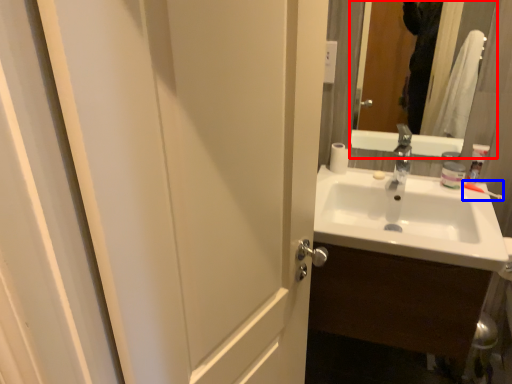
Question: Which of the following is the closest to the observer, mirror (highlighted by a red box) or toothbrush (highlighted by a blue box)?

Choices:
 (A) mirror
 (B) toothbrush

Answer: (A)